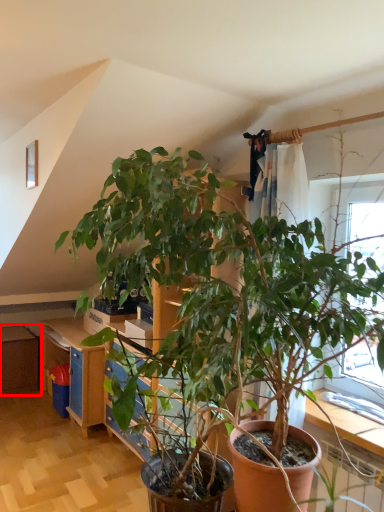
Question: From the image's perspective, what is the correct spatial positioning of dresser (annotated by the red box) in reference to dresser?

Choices:
 (A) below
 (B) above

Answer: (A)